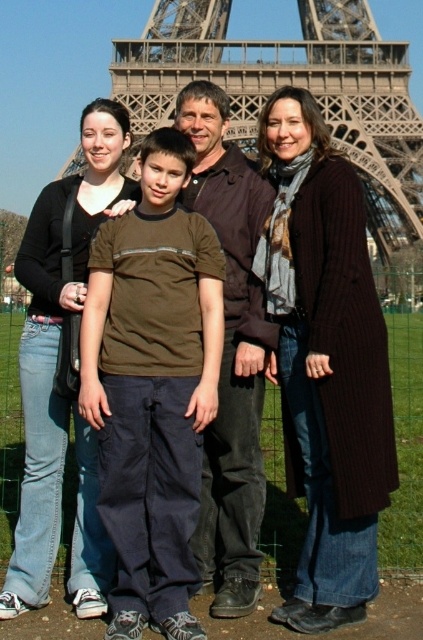
Question: Can you confirm if brown cotton shirt at center is positioned above metallic structure at center?

Choices:
 (A) no
 (B) yes

Answer: (A)

Question: Is brown wool coat at center further to the viewer compared to jeans at left?

Choices:
 (A) yes
 (B) no

Answer: (B)

Question: Is brown cotton shirt at center positioned before brown wool coat at center?

Choices:
 (A) yes
 (B) no

Answer: (A)

Question: Which point is farther to the camera?

Choices:
 (A) brown cotton shirt at center
 (B) metallic structure at center
 (C) brown wool coat at center

Answer: (B)

Question: Which object is positioned farthest from the brown wool coat at center?

Choices:
 (A) jeans at left
 (B) metallic structure at center

Answer: (B)

Question: Which object is positioned closest to the jeans at left?

Choices:
 (A) brown cotton shirt at center
 (B) brown wool coat at center

Answer: (A)